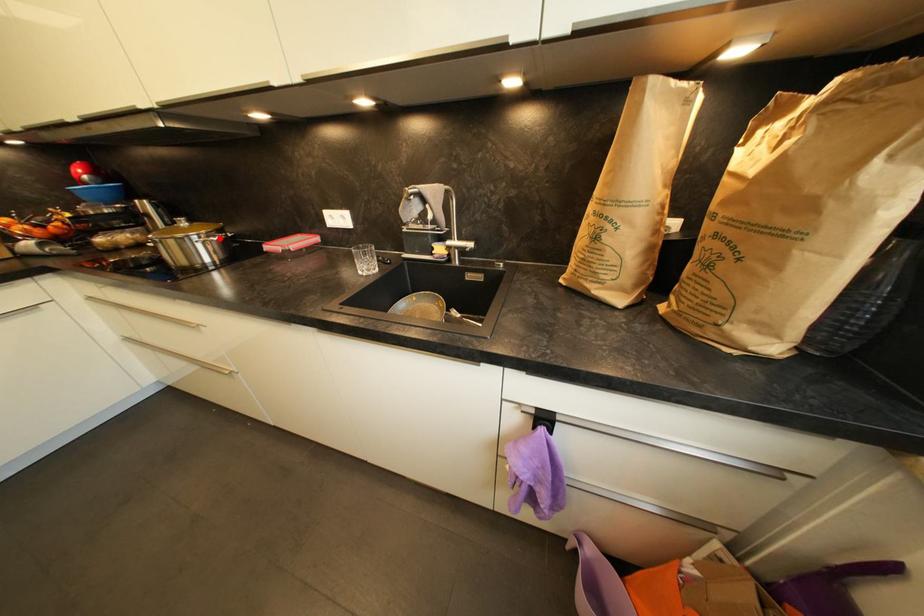
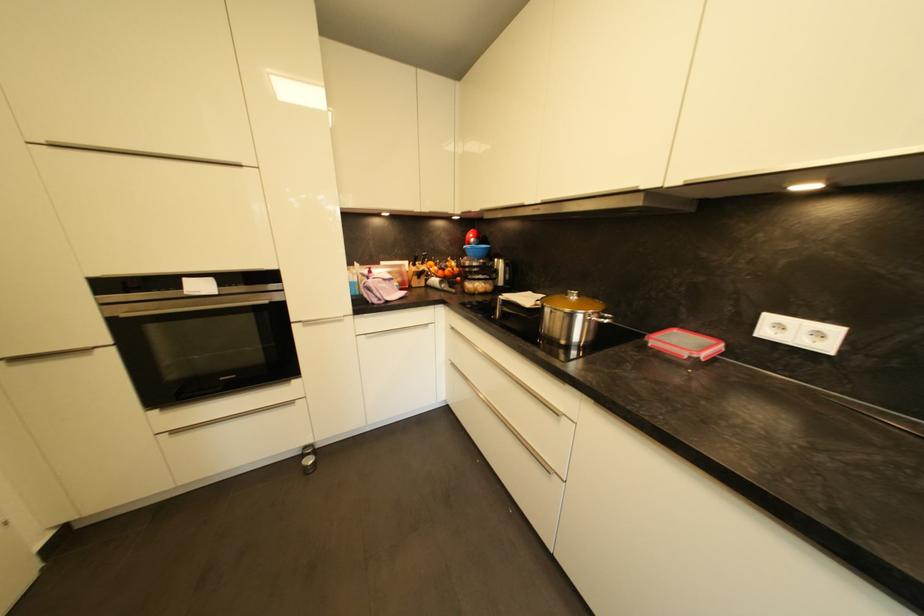
Locate, in the second image, the point that corresponds to the highlighted location in the first image.

(610, 320)